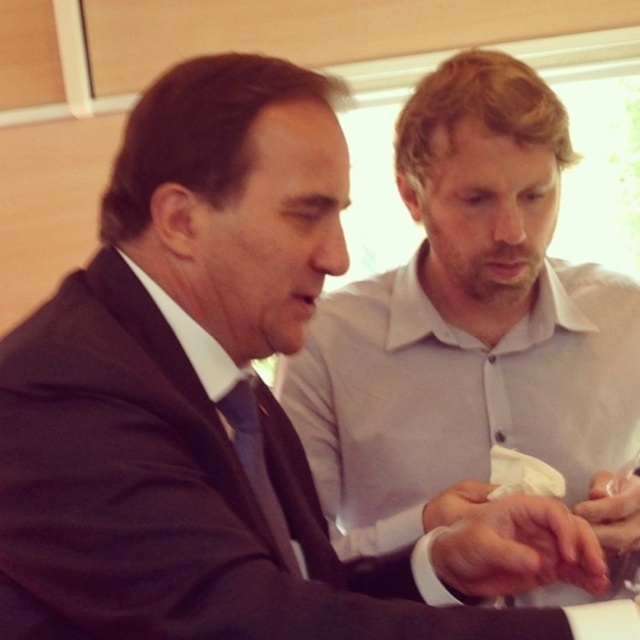
You are a photographer planning to take a group photo of the dark blue suit at left and the white smooth skin at center. Which of the two should you position closer to the camera to ensure both appear equally sized in the photo?

The dark blue suit at left is larger in size than the white smooth skin at center. To make them appear equally sized in the photo, you should position the white smooth skin at center closer to the camera than the dark blue suit at left.

You are a photographer setting up for a group photo. You notice the dark blue suit at left and the white smooth skin at center in the frame. Which subject should you adjust your focus to ensure clarity first?

The dark blue suit at left is closer to the viewer than the white smooth skin at center, so you should focus on the dark blue suit at left first to ensure proper depth of field.

You are a medical professional observing a patient and a doctor examining a skin sample. The patient is concerned about the size of the sample. Based on the image, which object is bigger between the white smooth skin at center and the white matte hand at center?

The white smooth skin at center is larger in size compared to the white matte hand at center, so the skin sample is bigger.